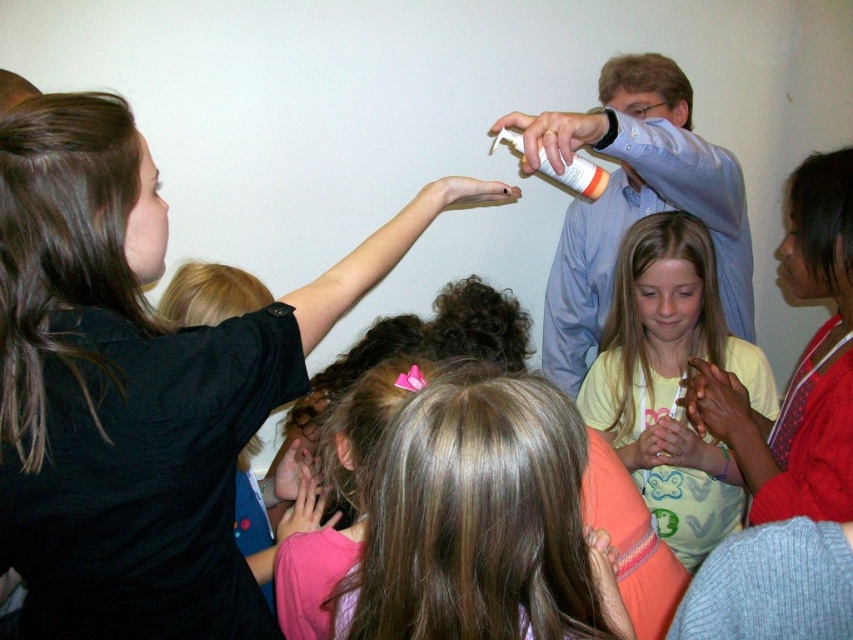
Can you confirm if blonde hair at center is wider than matte red shirt at center?

Yes, blonde hair at center is wider than matte red shirt at center.

Can you confirm if blonde hair at center is positioned to the left of matte red shirt at center?

Indeed, blonde hair at center is positioned on the left side of matte red shirt at center.

Between point (523, 572) and point (757, 506), which one is positioned behind?

Point (757, 506)

I want to click on blonde hair at center, so click(480, 522).

Can you confirm if yellow cotton shirt at center is thinner than white plastic bottle at upper center?

No.

Is yellow cotton shirt at center to the right of white plastic bottle at upper center from the viewer's perspective?

Correct, you'll find yellow cotton shirt at center to the right of white plastic bottle at upper center.

Which is behind, point (627, 358) or point (605, 172)?

Point (627, 358)

At what (x,y) coordinates should I click in order to perform the action: click on yellow cotton shirt at center. Please return your answer as a coordinate pair (x, y). The image size is (853, 640). Looking at the image, I should click on (671, 381).

Is point (606, 573) farther from viewer compared to point (585, 161)?

No.

Between blonde hair at center and white plastic bottle at upper center, which one has less height?

Standing shorter between the two is white plastic bottle at upper center.

This screenshot has width=853, height=640. Describe the element at coordinates (480, 522) in the screenshot. I see `blonde hair at center` at that location.

You are a GUI agent. You are given a task and a screenshot of the screen. Output one action in this format:
    pyautogui.click(x=<x>, y=<y>)
    Task: Click on the blonde hair at center
    The height and width of the screenshot is (640, 853).
    Given the screenshot: What is the action you would take?
    pyautogui.click(x=480, y=522)